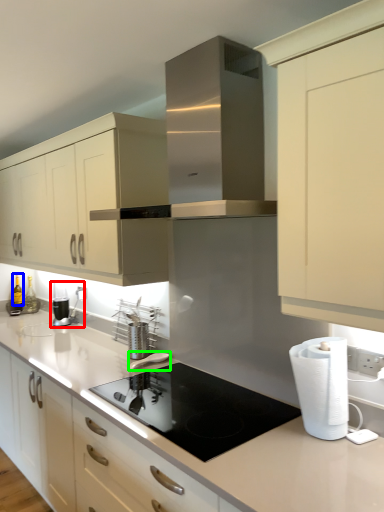
Question: Estimate the real-world distances between objects in this image. Which object is closer to coffee machine (highlighted by a red box), bottle (highlighted by a blue box) or appliance (highlighted by a green box)?

Choices:
 (A) bottle
 (B) appliance

Answer: (A)